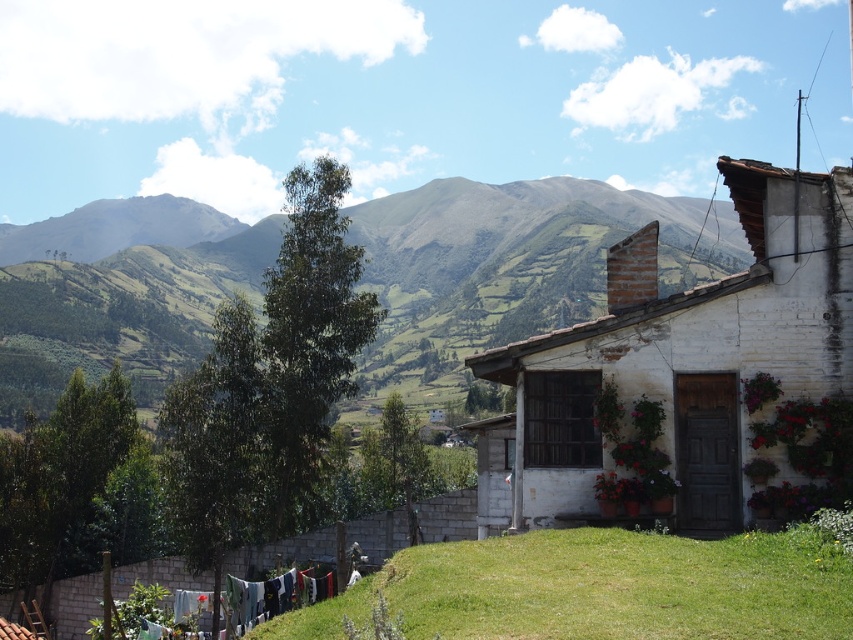
You are standing at the center of the image and want to determine which object is taller between the white brick house at right and the multicolored fabric at lower left. Based on the scene, which one is taller?

The white brick house at right is taller than the multicolored fabric at lower left.

You are standing on the porch of the white brick house at right and want to see the multicolored fabric at lower left. Which direction should you look to see it?

You should look to the lower left direction to see the multicolored fabric at lower left, as the white brick house at right is in front of it.

You are standing in front of the rustic house and want to determine the relative positions of two points marked in the scene. Which point, point (521, 340) or point (302, 600), is closer to you?

Point (521, 340) is closer to the viewer than point (302, 600).